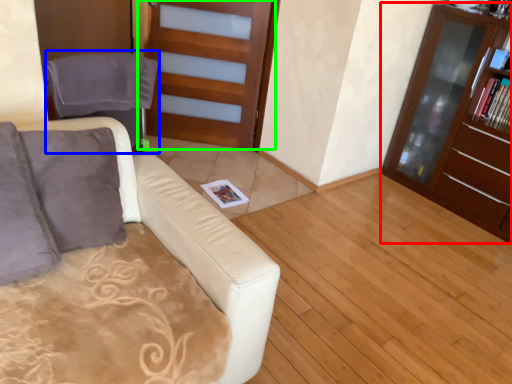
Question: Which is nearer to the cabinetry (highlighted by a red box)? swivel chair (highlighted by a blue box) or door (highlighted by a green box).

Choices:
 (A) swivel chair
 (B) door

Answer: (B)